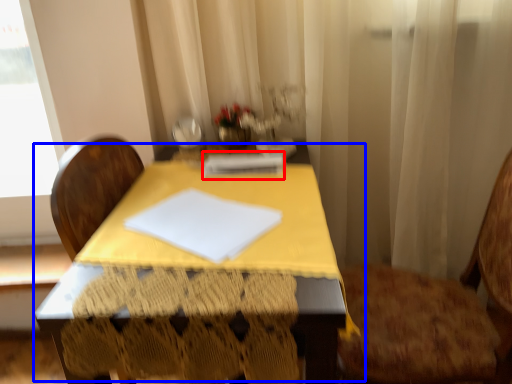
Question: Which of the following is the farthest to the observer, notebook (highlighted by a red box) or table (highlighted by a blue box)?

Choices:
 (A) notebook
 (B) table

Answer: (A)